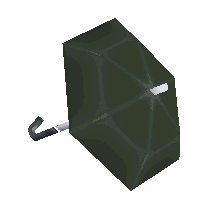
You are a GUI agent. You are given a task and a screenshot of the screen. Output one action in this format:
    pyautogui.click(x=<x>, y=<y>)
    Task: Click on the handle
    Image resolution: width=208 pixels, height=208 pixels.
    Given the screenshot: What is the action you would take?
    pyautogui.click(x=36, y=134)